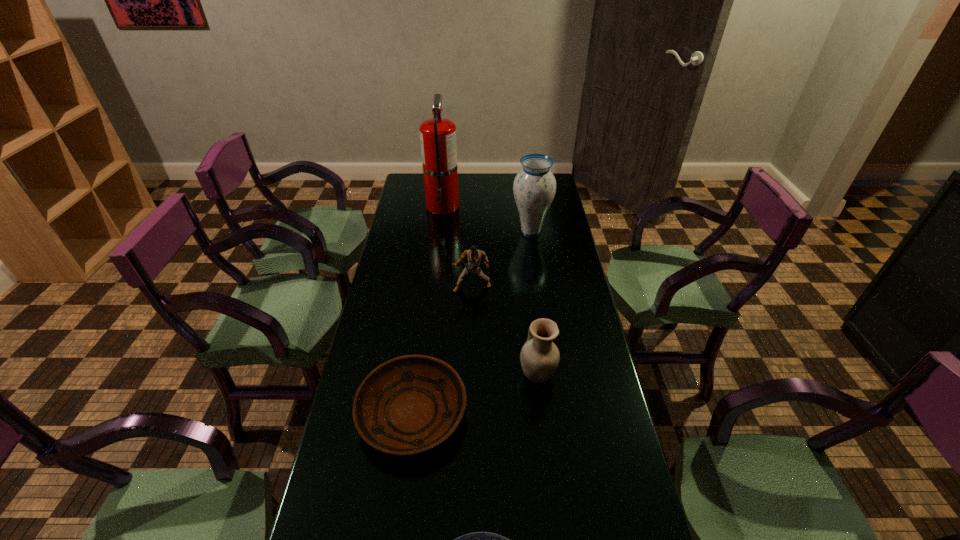
Find the location of `vacant space that satisfies the following two spatial constraints: 1. on the front-facing side of the fourth nearest object; 2. on the left side of the pottery`. vacant space that satisfies the following two spatial constraints: 1. on the front-facing side of the fourth nearest object; 2. on the left side of the pottery is located at coordinates (470, 374).

Where is `free spot that satisfies the following two spatial constraints: 1. at the nozzle of the pottery; 2. on the right side of the fire extinguisher`? This screenshot has height=540, width=960. free spot that satisfies the following two spatial constraints: 1. at the nozzle of the pottery; 2. on the right side of the fire extinguisher is located at coordinates (422, 374).

The height and width of the screenshot is (540, 960). In order to click on free location that satisfies the following two spatial constraints: 1. at the nozzle of the farthest object; 2. on the right side of the fifth shortest object in this screenshot , I will do `click(440, 232)`.